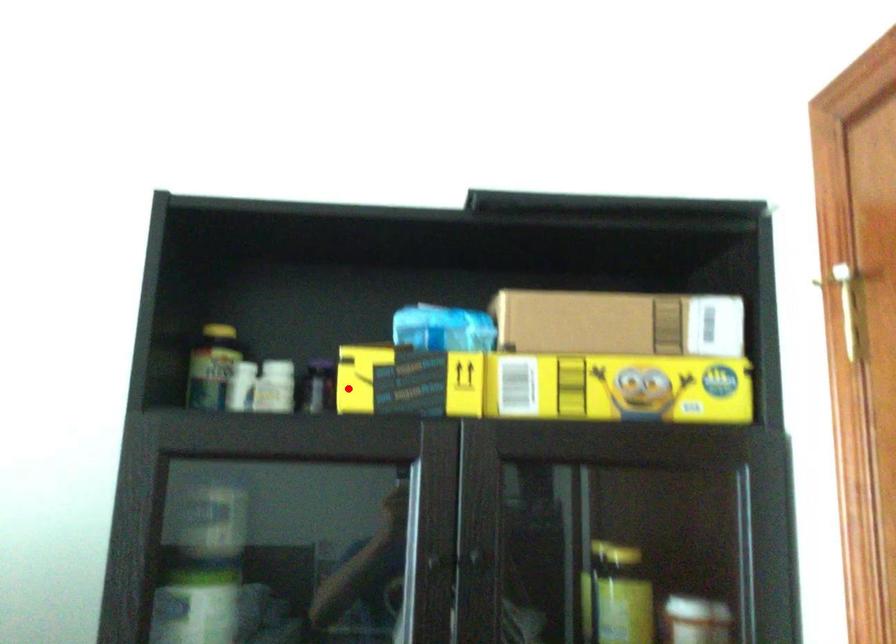
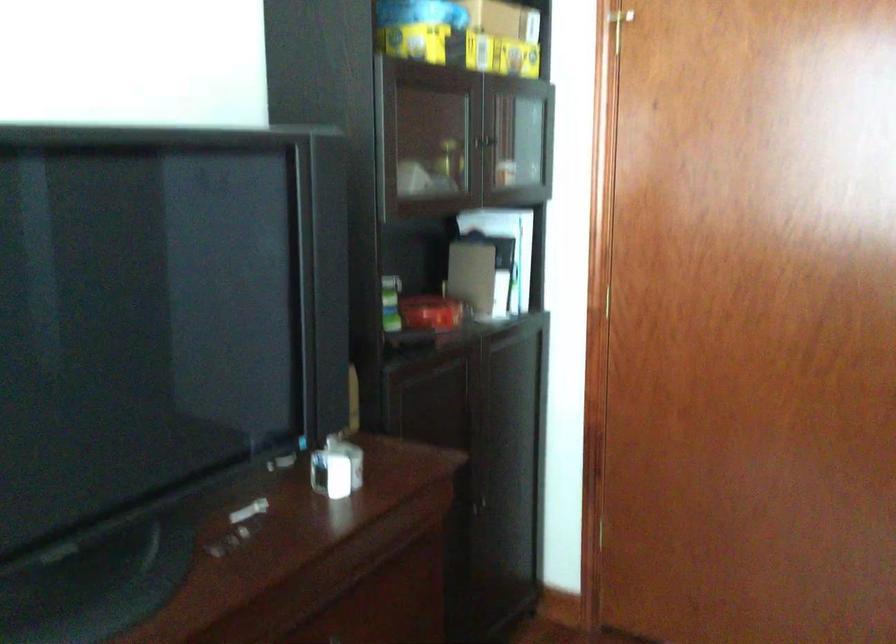
Question: I am providing you with two images of the same scene from different viewpoints. In image1, a red point is highlighted. Considering the same 3D point in image2, which of the following is correct?

Choices:
 (A) It is closer
 (B) It is farther

Answer: (B)